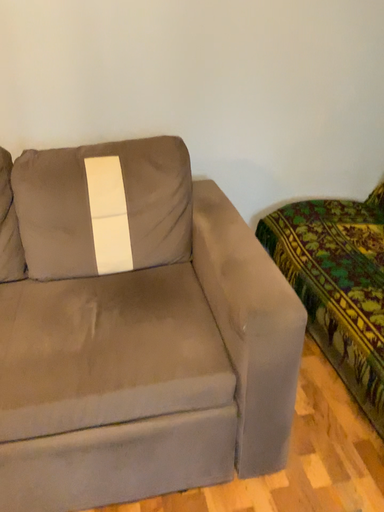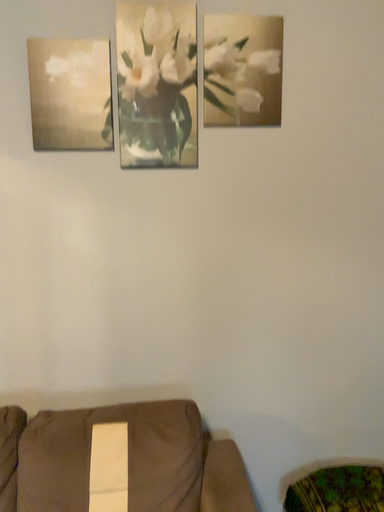
Question: Which way did the camera rotate in the video?

Choices:
 (A) rotated upward
 (B) rotated downward

Answer: (A)